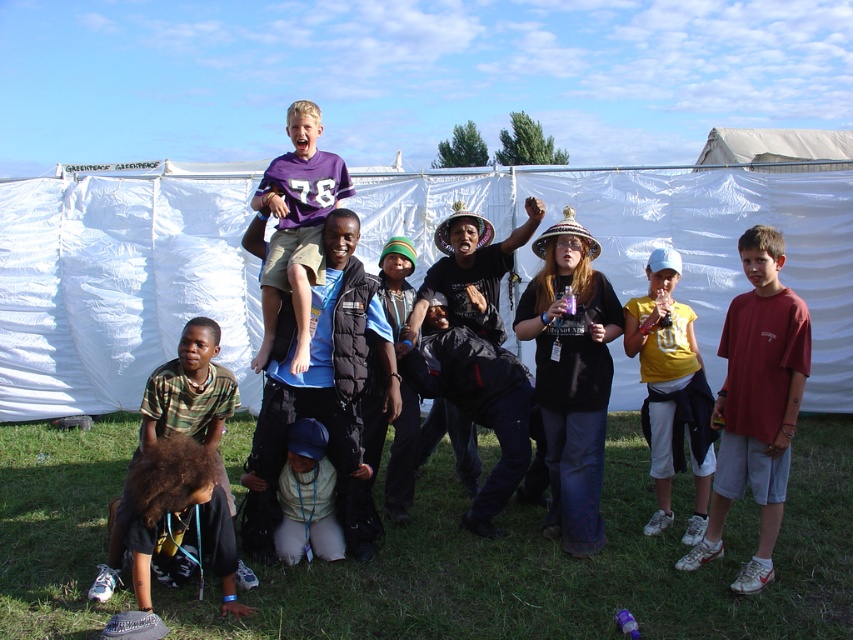
Question: Considering the real-world distances, which object is closest to the purple jersey at center?

Choices:
 (A) green grass at lower center
 (B) white fabric tent at upper center
 (C) yellow cotton shirt at center-right

Answer: (A)

Question: From the image, what is the correct spatial relationship of white fabric tent at upper center in relation to light green fabric at lower center?

Choices:
 (A) above
 (B) below

Answer: (A)

Question: From the image, what is the correct spatial relationship of white fabric tent at upper center in relation to green grass at lower center?

Choices:
 (A) left
 (B) right

Answer: (A)

Question: Is yellow cotton shirt at center-right to the right of purple jersey at center from the viewer's perspective?

Choices:
 (A) yes
 (B) no

Answer: (A)

Question: Based on their relative distances, which object is nearer to the black puffer vest at center?

Choices:
 (A) matte red t-shirt at right
 (B) white fabric tent at upper center
 (C) yellow cotton shirt at center-right
 (D) purple jersey at center

Answer: (D)

Question: Which object is the farthest from the camouflage fabric shirt at lower left?

Choices:
 (A) matte red t-shirt at right
 (B) green grass at lower center

Answer: (A)